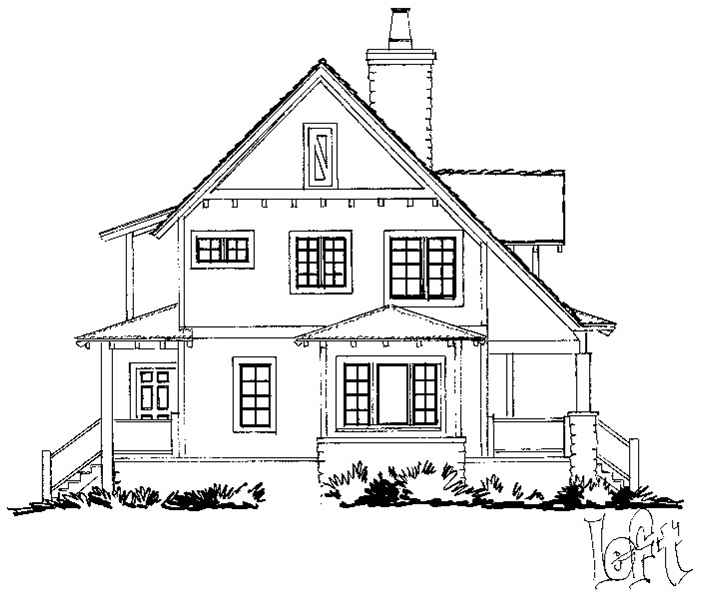
Locate an element on the screen. chimney is located at coordinates [410, 81].